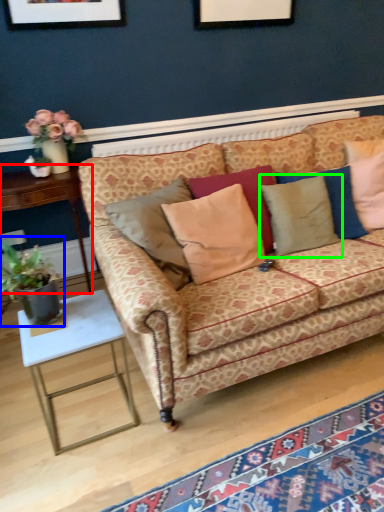
Question: Which is farther away from table (highlighted by a red box)? houseplant (highlighted by a blue box) or pillow (highlighted by a green box)?

Choices:
 (A) houseplant
 (B) pillow

Answer: (B)